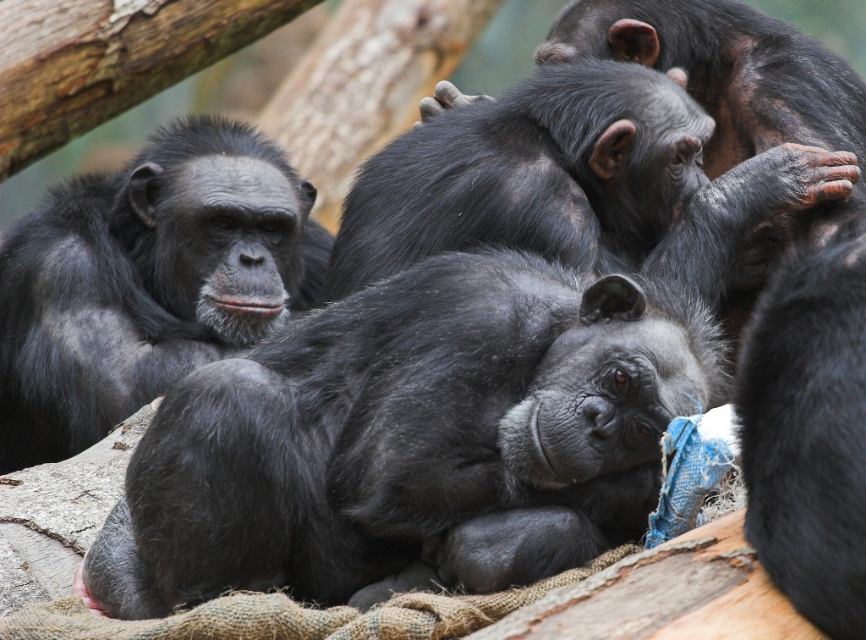
You are a zookeeper observing chimpanzees in their enclosure. You notice a point marked at coordinates (412,440). Which chimpanzee does this point correspond to?

The point at coordinates (412,440) corresponds to the black fur monkey at center.

You are a wildlife photographer standing 5 feet away from the camera. You want to take a photo of the black fur monkey at center. Can you get close enough to capture a clear, detailed image without using a zoom lens?

The black fur monkey at center is 6.11 feet away from the camera. Since you are standing 5 feet away from the camera, the total distance between you and the monkey would be 11.11 feet. Without a zoom lens, this distance might be too far to capture a clear, detailed image.